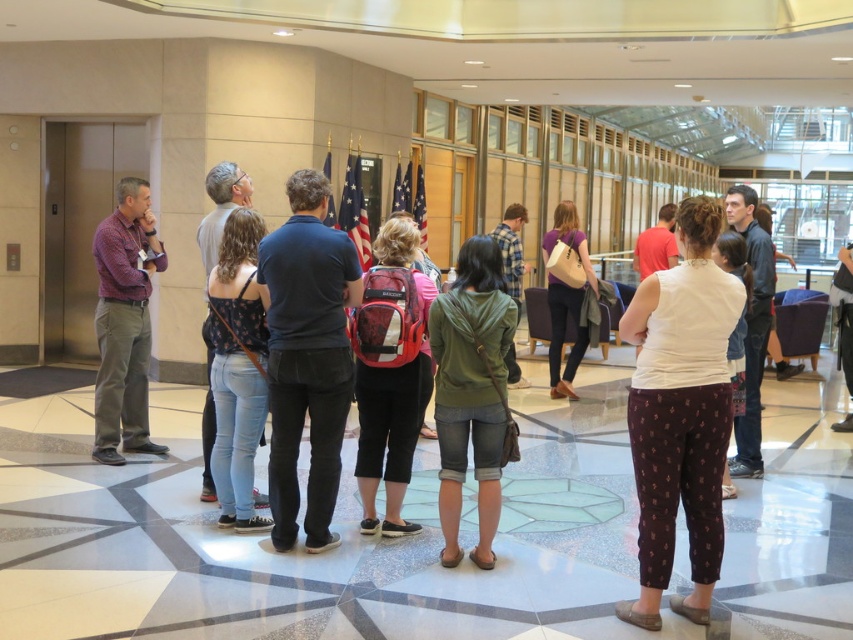
Question: Does dark blue cotton shirt at center have a smaller size compared to red backpack at center?

Choices:
 (A) yes
 (B) no

Answer: (A)

Question: Which point is closer to the camera?

Choices:
 (A) (477, 385)
 (B) (268, 257)
 (C) (401, 284)
 (D) (689, 289)

Answer: (D)

Question: Which of the following is the farthest from the observer?

Choices:
 (A) (494, 394)
 (B) (323, 528)
 (C) (692, 378)

Answer: (B)

Question: Can you confirm if dark blue cotton shirt at center is positioned to the left of denim jeans at center?

Choices:
 (A) no
 (B) yes

Answer: (A)

Question: Which point is farther to the camera?

Choices:
 (A) dark blue cotton shirt at center
 (B) green matte hoodie at center
 (C) red backpack at center

Answer: (C)

Question: Is green matte hoodie at center positioned in front of denim jeans at center?

Choices:
 (A) no
 (B) yes

Answer: (B)